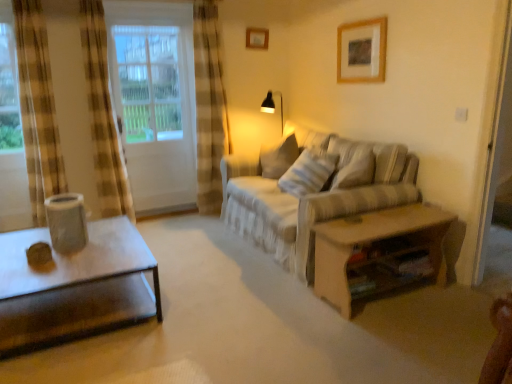
Question: From a real-world perspective, is wooden table at right positioned above or below wooden picture frame at upper center, the first picture frame in the front-to-back sequence?

Choices:
 (A) above
 (B) below

Answer: (B)

Question: Considering the relative positions of wooden table at right and wooden picture frame at upper center, the first picture frame in the front-to-back sequence, in the image provided, is wooden table at right to the left or to the right of wooden picture frame at upper center, the first picture frame in the front-to-back sequence,?

Choices:
 (A) left
 (B) right

Answer: (A)

Question: Which of these objects is positioned closest to the matte plastic speaker at left?

Choices:
 (A) matte black table lamp at upper center
 (B) wooden table at right
 (C) white striped fabric pillow at center
 (D) beige fabric couch at center
 (E) wooden picture frame at upper center, positioned as the 1th picture frame in bottom-to-top order

Answer: (D)

Question: Which is nearer to the white glass door at left?

Choices:
 (A) wooden picture frame at upper center, marked as the 2th picture frame in a right-to-left arrangement
 (B) matte plastic speaker at left
 (C) beige fabric couch at center
 (D) wooden picture frame at upper center, the first picture frame in the front-to-back sequence
 (E) white striped fabric pillow at center

Answer: (A)